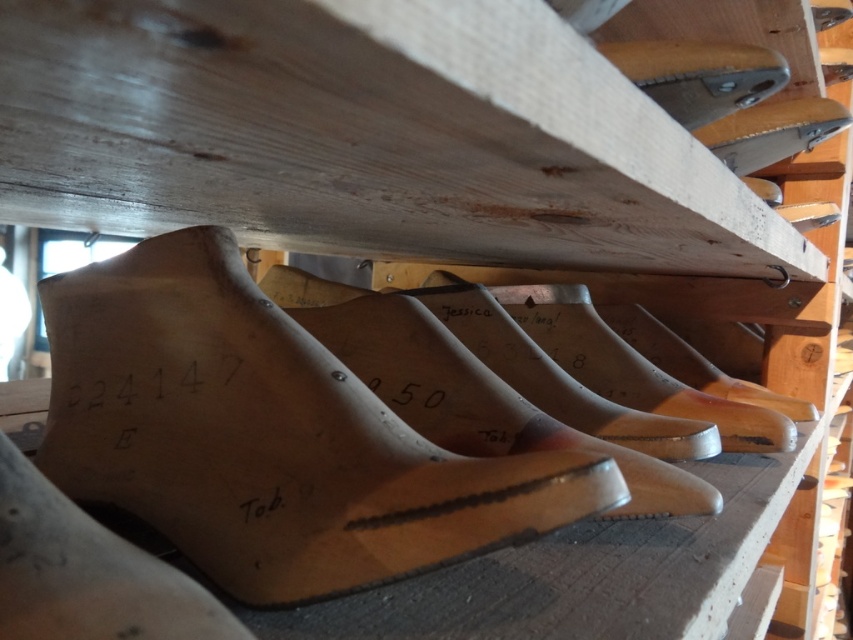
Question: Among these objects, which one is nearest to the camera?

Choices:
 (A) wooden shoe at upper center
 (B) natural wood shoe at center

Answer: (B)

Question: In this image, where is natural wood shoe at center located relative to light brown wood shoe at lower left?

Choices:
 (A) right
 (B) left

Answer: (A)

Question: Which point is farther to the camera?

Choices:
 (A) (764, 60)
 (B) (755, 129)
 (C) (84, 336)

Answer: (B)

Question: Does natural wood shoe at center appear on the right side of wooden shoe at upper right?

Choices:
 (A) yes
 (B) no

Answer: (B)

Question: Among these objects, which one is nearest to the camera?

Choices:
 (A) wooden shoe at upper center
 (B) light brown wood shoe at lower left
 (C) wooden shoe at upper right

Answer: (B)

Question: Does light brown wood shoe at lower left have a greater width compared to wooden shoe at upper center?

Choices:
 (A) no
 (B) yes

Answer: (A)